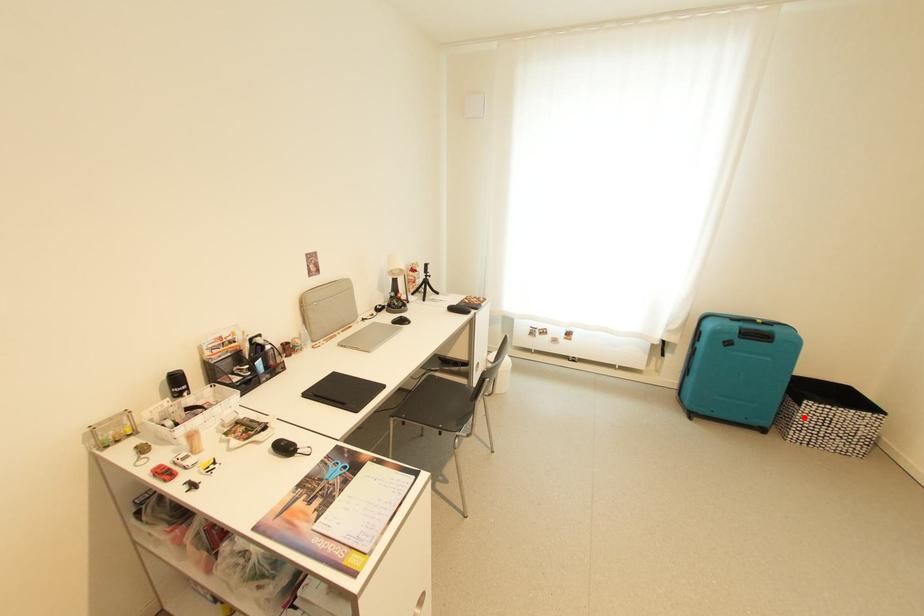
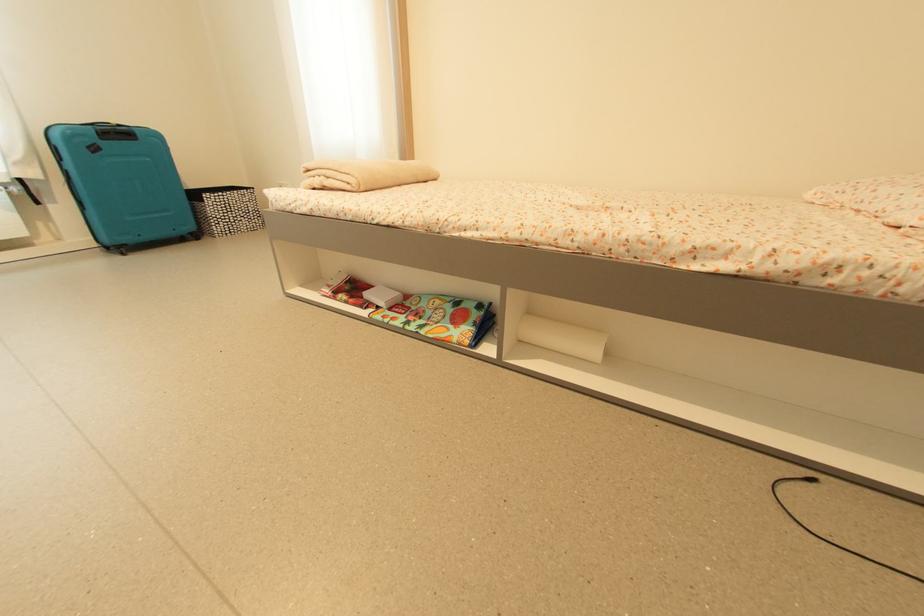
Question: I am providing you with two images of the same scene from different viewpoints. A red point is shown in image1. For the corresponding object point in image2, is it positioned nearer or farther from the camera?

Choices:
 (A) Nearer
 (B) Farther

Answer: (A)